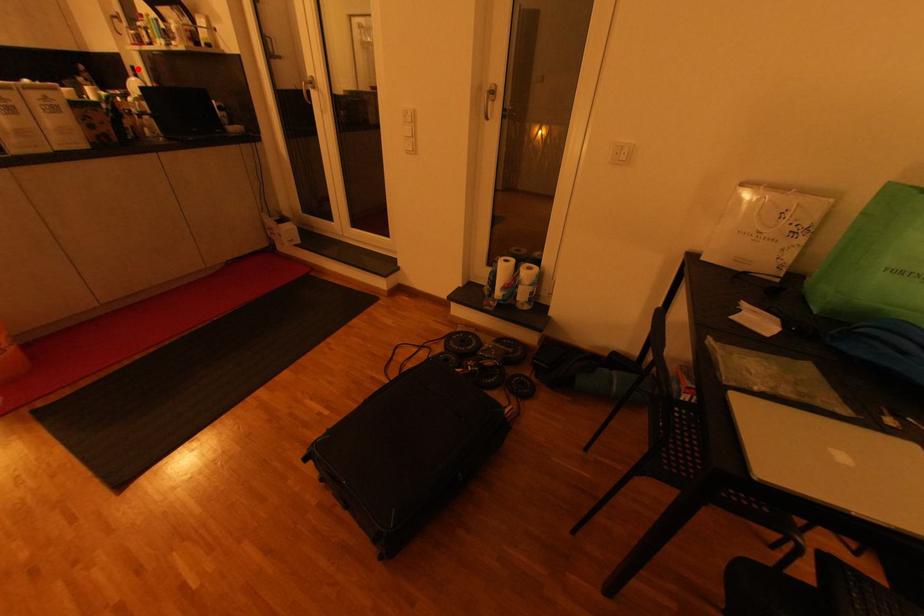
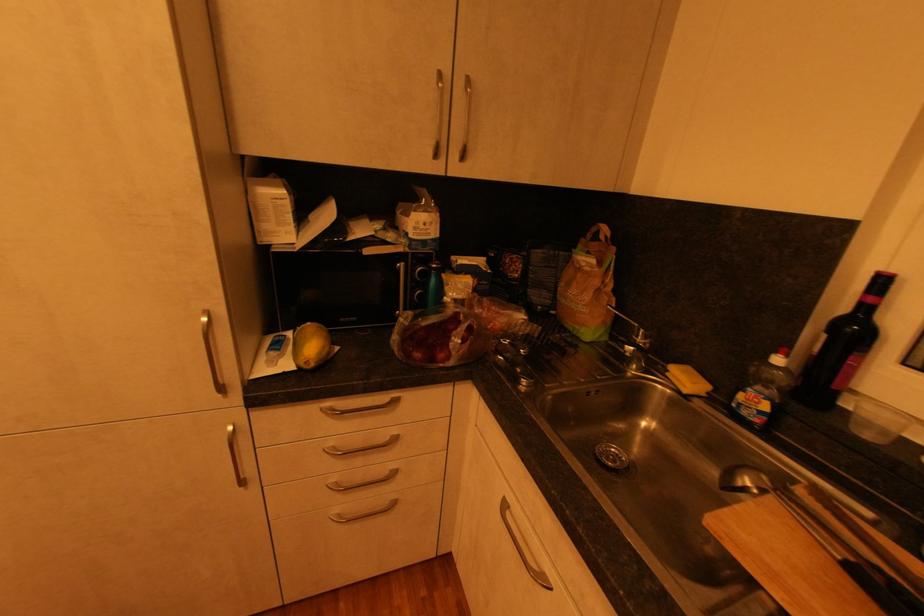
The point at the highlighted location is marked in the first image. Where is the corresponding point in the second image?

(889, 282)